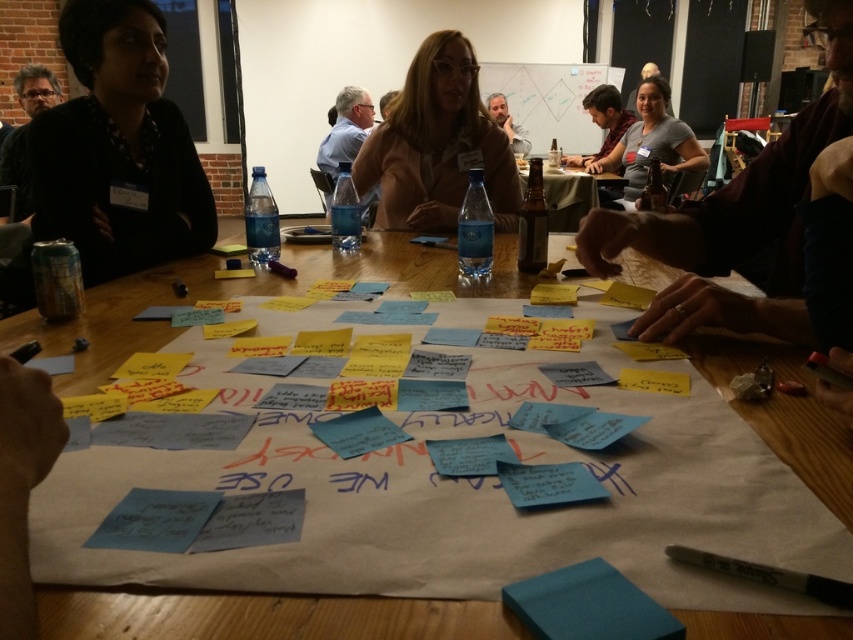
Question: Does brown glass bottle at center appear on the right side of matte black hair at upper center?

Choices:
 (A) no
 (B) yes

Answer: (B)

Question: Considering the relative positions of white paper at center and dark gray shirt at upper right in the image provided, where is white paper at center located with respect to dark gray shirt at upper right?

Choices:
 (A) left
 (B) right

Answer: (A)

Question: Which object is the farthest from the matte black hair at upper center?

Choices:
 (A) dark brown leather jacket at upper right
 (B) black fabric shirt at left
 (C) dark brown leather jacket at center
 (D) brown glass bottle at center

Answer: (A)

Question: Which point appears farthest from the camera in this image?

Choices:
 (A) (190, 192)
 (B) (556, 230)
 (C) (685, 214)

Answer: (B)

Question: Observing the image, what is the correct spatial positioning of dark gray shirt at upper right in reference to matte black hair at upper center?

Choices:
 (A) right
 (B) left

Answer: (A)

Question: Which object is positioned farthest from the dark brown leather jacket at center?

Choices:
 (A) white paper at center
 (B) dark gray shirt at upper right

Answer: (A)